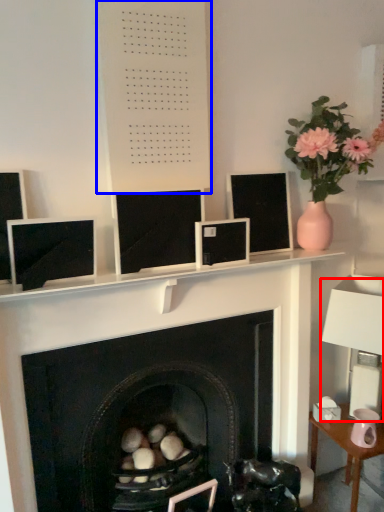
Question: Which object is further to the camera taking this photo, table lamp (highlighted by a red box) or bulletin board (highlighted by a blue box)?

Choices:
 (A) table lamp
 (B) bulletin board

Answer: (A)